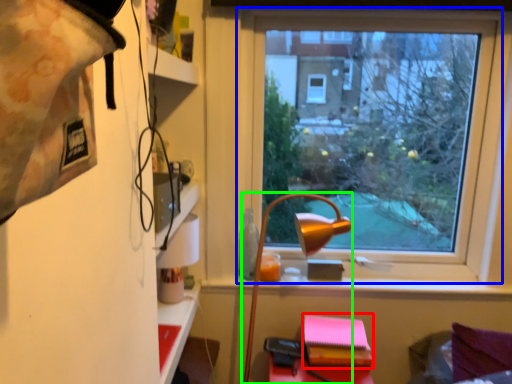
Question: Considering the real-world distances, which object is farthest from notebook (highlighted by a red box)? window (highlighted by a blue box) or lamp (highlighted by a green box)?

Choices:
 (A) window
 (B) lamp

Answer: (A)